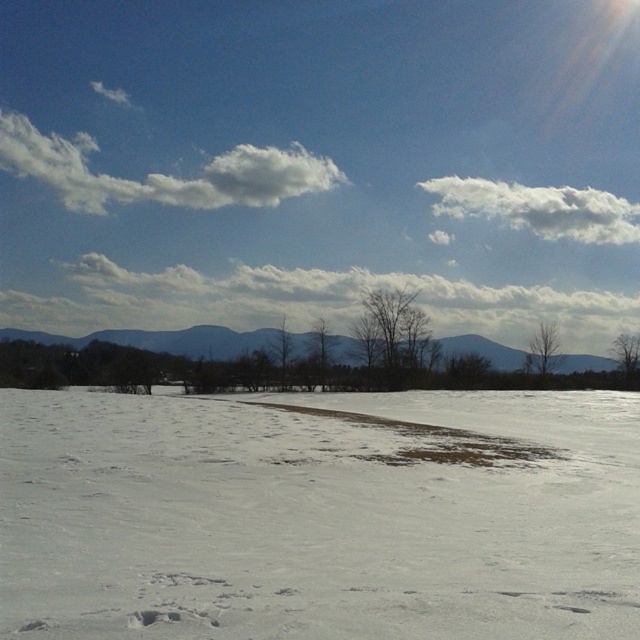
Measure the distance between white fluffy cloud at upper left and camera.

white fluffy cloud at upper left and camera are 398.57 feet apart.

Is white fluffy cloud at upper left taller than gray matte mountain at center?

Correct, white fluffy cloud at upper left is much taller as gray matte mountain at center.

Where is `white fluffy cloud at upper left`? white fluffy cloud at upper left is located at coordinates tap(161, 173).

The height and width of the screenshot is (640, 640). Identify the location of white fluffy cloud at upper left. (161, 173).

Does white powdery snow at center appear on the right side of gray matte mountain at center?

Indeed, white powdery snow at center is positioned on the right side of gray matte mountain at center.

Between point (454, 394) and point (444, 352), which one is positioned in front?

Positioned in front is point (454, 394).

Locate an element on the screen. This screenshot has width=640, height=640. white powdery snow at center is located at coordinates (317, 516).

Which of these two, white powdery snow at center or white fluffy cloud at upper left, stands shorter?

Standing shorter between the two is white powdery snow at center.

Does white powdery snow at center appear under white fluffy cloud at upper left?

Correct, white powdery snow at center is located below white fluffy cloud at upper left.

What do you see at coordinates (317, 516) in the screenshot? I see `white powdery snow at center` at bounding box center [317, 516].

Locate an element on the screen. white powdery snow at center is located at coordinates (317, 516).